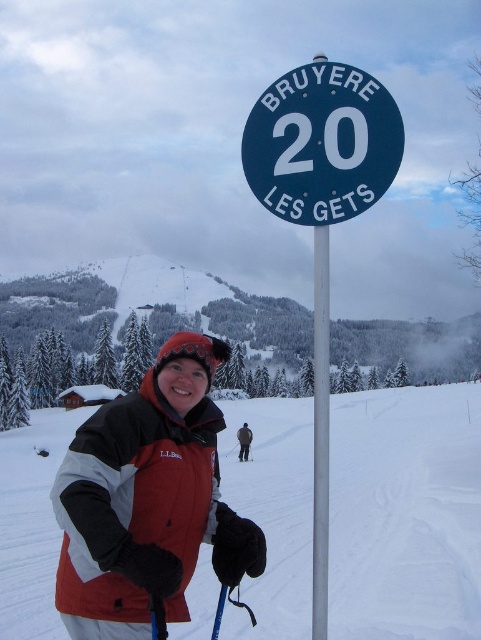
Between red fleece jacket at center and black matte ski at center, which one appears on the left side from the viewer's perspective?

red fleece jacket at center

Who is positioned more to the right, red fleece jacket at center or black matte ski at center?

black matte ski at center

Which is behind, point (112, 600) or point (243, 458)?

Positioned behind is point (243, 458).

You are a GUI agent. You are given a task and a screenshot of the screen. Output one action in this format:
    pyautogui.click(x=<x>, y=<y>)
    Task: Click on the red fleece jacket at center
    
    Given the screenshot: What is the action you would take?
    pyautogui.click(x=148, y=500)

Between dark gray jacket at center and black matte ski at center, which one is positioned lower?

black matte ski at center is below.

Is dark gray jacket at center to the right of black matte ski at center from the viewer's perspective?

In fact, dark gray jacket at center is to the left of black matte ski at center.

Where is `dark gray jacket at center`? Image resolution: width=481 pixels, height=640 pixels. dark gray jacket at center is located at coordinates (243, 442).

You are a GUI agent. You are given a task and a screenshot of the screen. Output one action in this format:
    pyautogui.click(x=<x>, y=<y>)
    Task: Click on the dark gray jacket at center
    This screenshot has width=481, height=640.
    Given the screenshot: What is the action you would take?
    pyautogui.click(x=243, y=442)

Measure the distance between point (314, 358) and camera.

Point (314, 358) is 82.71 meters away from camera.

Consider the image. Is metallic pole at center wider than dark gray jacket at center?

Correct, the width of metallic pole at center exceeds that of dark gray jacket at center.

You are a GUI agent. You are given a task and a screenshot of the screen. Output one action in this format:
    pyautogui.click(x=<x>, y=<y>)
    Task: Click on the metallic pole at center
    
    Given the screenshot: What is the action you would take?
    pyautogui.click(x=320, y=433)

Locate an element on the screen. metallic pole at center is located at coordinates (320, 433).